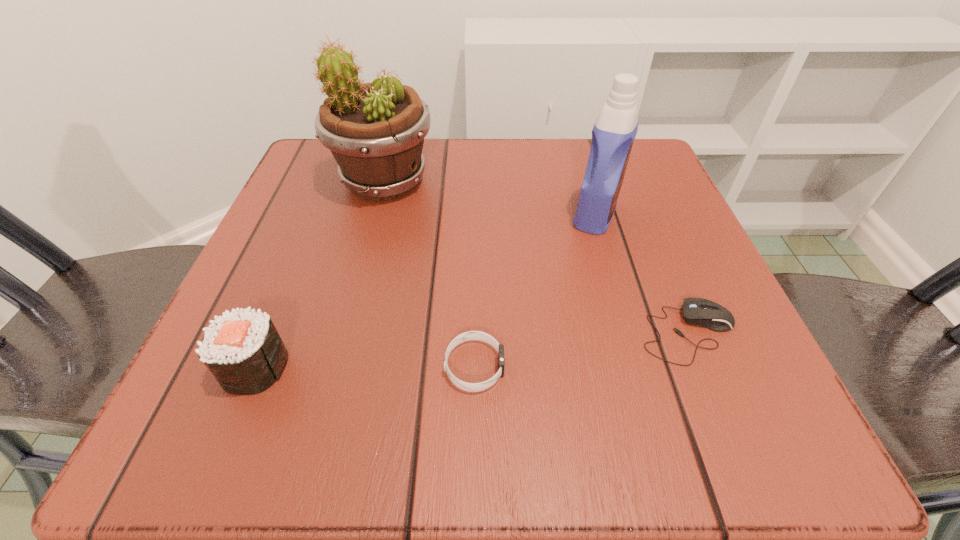
Identify the location of flowerpot. Image resolution: width=960 pixels, height=540 pixels. (375, 131).

Identify the location of detergent. (613, 134).

Where is `the third tallest object`? the third tallest object is located at coordinates (244, 352).

This screenshot has height=540, width=960. I want to click on wristband, so click(471, 335).

Where is `computer mouse`? This screenshot has width=960, height=540. computer mouse is located at coordinates (697, 311).

The width and height of the screenshot is (960, 540). I want to click on vacant region located 0.090m on the right of the flowerpot, so point(481,181).

In order to click on blank space located 0.340m on the left of the detergent in this screenshot , I will do `click(384, 214)`.

The width and height of the screenshot is (960, 540). What are the coordinates of `free point located on the right of the third tallest object` in the screenshot? It's located at (445, 367).

Find the location of a particular element. The height and width of the screenshot is (540, 960). vacant position located 0.150m on the outer surface of the wristband is located at coordinates (617, 367).

The width and height of the screenshot is (960, 540). In order to click on vacant region located on the left of the computer mouse in this screenshot , I will do `click(497, 334)`.